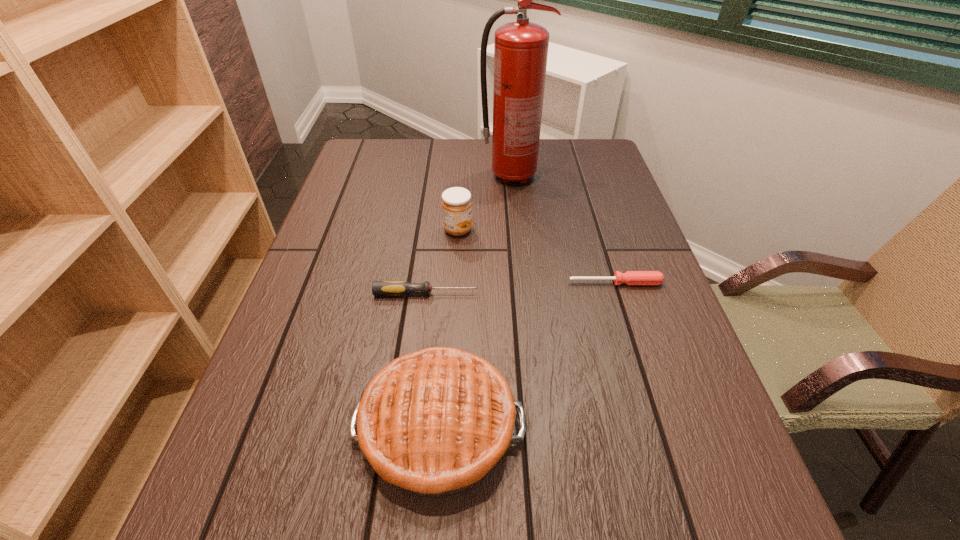
Find the location of a particular element. This screenshot has height=540, width=960. fire extinguisher is located at coordinates (520, 48).

The width and height of the screenshot is (960, 540). I want to click on the tallest object, so click(x=520, y=48).

Locate an element on the screen. This screenshot has width=960, height=540. the fourth nearest object is located at coordinates (456, 203).

Locate an element on the screen. the nearest object is located at coordinates (435, 421).

At what (x,y) coordinates should I click in order to perform the action: click on the second nearest object. Please return your answer as a coordinate pair (x, y). The image size is (960, 540). Looking at the image, I should click on (400, 288).

Image resolution: width=960 pixels, height=540 pixels. I want to click on the nearer screwdriver, so click(x=400, y=288).

Identify the location of the farther screwdriver. This screenshot has width=960, height=540. (630, 277).

Locate an element on the screen. The width and height of the screenshot is (960, 540). the right screwdriver is located at coordinates (630, 277).

This screenshot has height=540, width=960. I want to click on free point located 0.110m on the handle side the tallest object, so click(x=580, y=176).

Where is `vacant space situated 0.170m on the front label of the fourth nearest object`? This screenshot has width=960, height=540. vacant space situated 0.170m on the front label of the fourth nearest object is located at coordinates point(538,230).